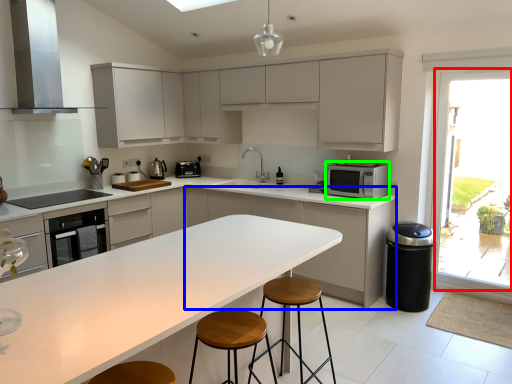
Question: Considering the real-world distances, which object is closest to window (highlighted by a red box)? cabinetry (highlighted by a blue box) or microwave oven (highlighted by a green box).

Choices:
 (A) cabinetry
 (B) microwave oven

Answer: (B)